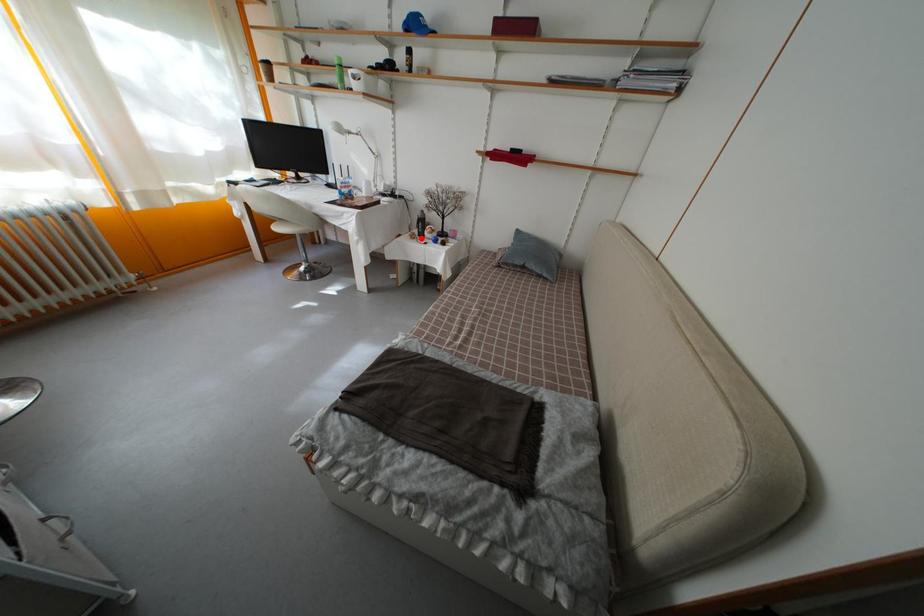
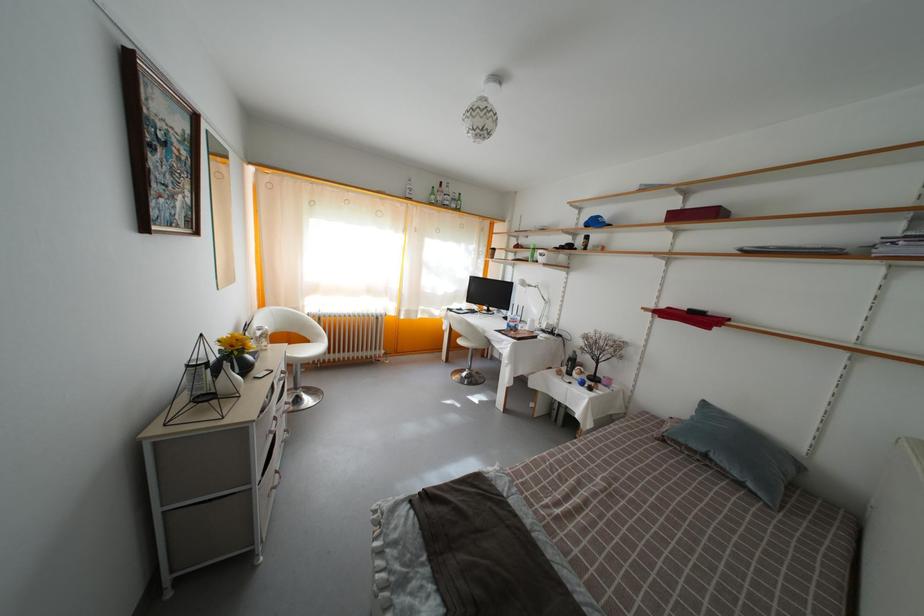
Question: I am providing you with two images of the same scene from different viewpoints. Given a red point in image1, look at the same physical point in image2. Is it:

Choices:
 (A) Closer to the viewpoint
 (B) Farther from the viewpoint

Answer: (A)